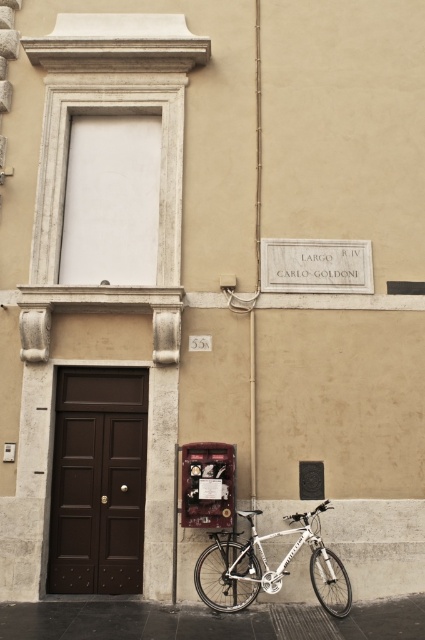
You are a delivery person trying to deliver a package to the building. You notice the brown wooden door at center and the metallic red phone box at lower center. Which object is larger in size?

The brown wooden door at center is bigger than the metallic red phone box at lower center, so the brown wooden door at center is larger in size.

You are standing in front of the beige building and want to determine the relative positions of two points marked on the facade. Which point is closer to you, the point at coordinate (263, 572) or the point at (187, 492)?

The point at coordinate (263, 572) is further to the viewer than the point at (187, 492), so the point at (187, 492) is closer to you.